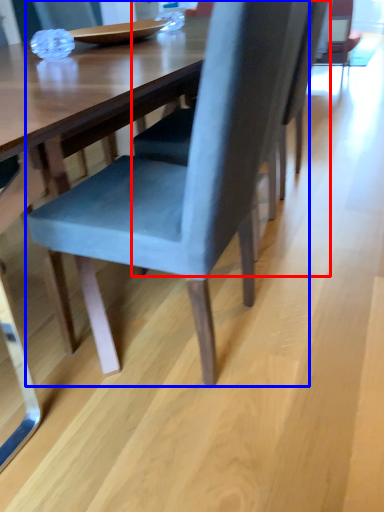
Question: Which of the following is the farthest to the observer, chair (highlighted by a red box) or chair (highlighted by a blue box)?

Choices:
 (A) chair
 (B) chair

Answer: (A)